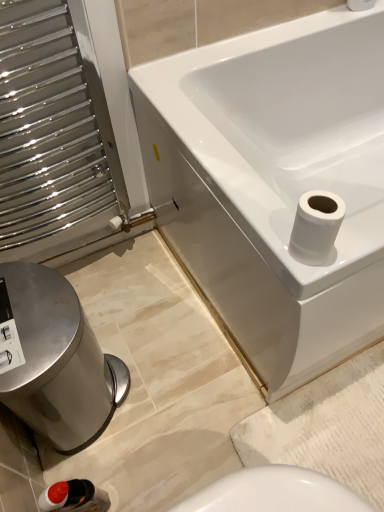
Question: Considering the relative sizes of white matte toilet paper at upper right, the first toilet paper in the top-to-bottom sequence, and white glossy bathtub at upper right in the image provided, is white matte toilet paper at upper right, the first toilet paper in the top-to-bottom sequence, shorter than white glossy bathtub at upper right?

Choices:
 (A) yes
 (B) no

Answer: (A)

Question: From a real-world perspective, is white matte toilet paper at upper right, which is counted as the 2th toilet paper, starting from the front, on white glossy bathtub at upper right?

Choices:
 (A) no
 (B) yes

Answer: (B)

Question: From the image's perspective, does white matte toilet paper at upper right, the second toilet paper in the left-to-right sequence, appear higher than white glossy bathtub at upper right?

Choices:
 (A) no
 (B) yes

Answer: (B)

Question: Are white matte toilet paper at upper right, marked as the 2th toilet paper in a bottom-to-top arrangement, and white glossy bathtub at upper right located far from each other?

Choices:
 (A) no
 (B) yes

Answer: (A)

Question: Does white matte toilet paper at upper right, the second toilet paper in the left-to-right sequence, have a smaller size compared to white glossy bathtub at upper right?

Choices:
 (A) yes
 (B) no

Answer: (A)

Question: Considering the relative positions of polished stainless steel bidet at lower left and matte black bottle at lower left in the image provided, is polished stainless steel bidet at lower left to the left or to the right of matte black bottle at lower left?

Choices:
 (A) right
 (B) left

Answer: (B)

Question: In terms of size, does polished stainless steel bidet at lower left appear bigger or smaller than matte black bottle at lower left?

Choices:
 (A) big
 (B) small

Answer: (A)

Question: Is polished stainless steel bidet at lower left in front of or behind matte black bottle at lower left in the image?

Choices:
 (A) behind
 (B) front

Answer: (A)

Question: From a real-world perspective, is polished stainless steel bidet at lower left above or below matte black bottle at lower left?

Choices:
 (A) above
 (B) below

Answer: (A)

Question: Considering the positions of matte black bottle at lower left and white glossy toilet paper at upper right, which is counted as the first toilet paper, starting from the left, in the image, is matte black bottle at lower left taller or shorter than white glossy toilet paper at upper right, which is counted as the first toilet paper, starting from the left,?

Choices:
 (A) tall
 (B) short

Answer: (A)

Question: Based on their positions, is matte black bottle at lower left located to the left or right of white glossy toilet paper at upper right, which is counted as the first toilet paper, starting from the left?

Choices:
 (A) right
 (B) left

Answer: (B)

Question: Looking at their shapes, would you say matte black bottle at lower left is wider or thinner than white glossy toilet paper at upper right, which is the 2th toilet paper from top to bottom?

Choices:
 (A) thin
 (B) wide

Answer: (B)

Question: From a real-world perspective, is matte black bottle at lower left above or below white glossy toilet paper at upper right, which is counted as the first toilet paper, starting from the left?

Choices:
 (A) above
 (B) below

Answer: (B)

Question: Would you say matte black bottle at lower left is inside or outside white glossy bathtub at upper right?

Choices:
 (A) inside
 (B) outside

Answer: (B)

Question: In the image, is matte black bottle at lower left positioned in front of or behind white glossy bathtub at upper right?

Choices:
 (A) front
 (B) behind

Answer: (A)